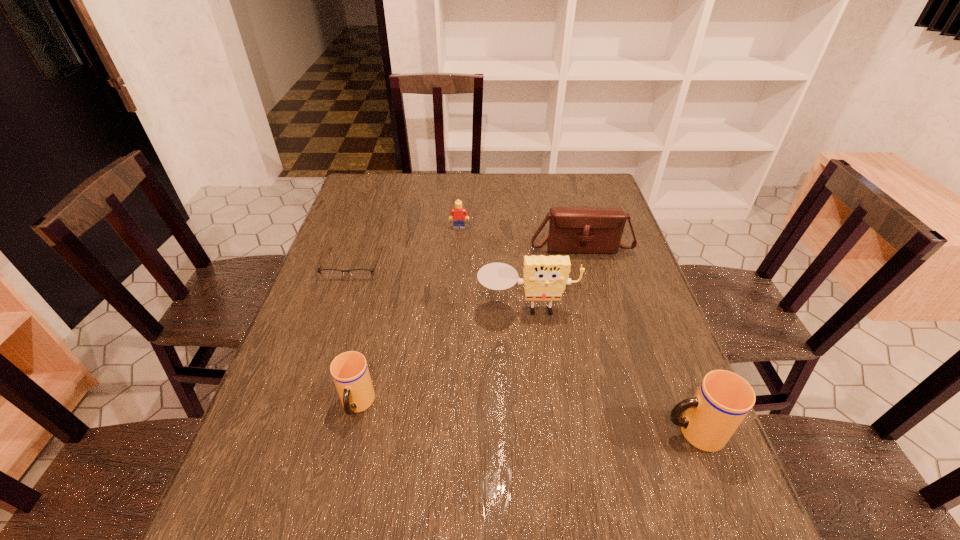
Find the location of a particular element. The image size is (960, 540). the shorter cup is located at coordinates (349, 370).

What are the coordinates of `the right cup` in the screenshot? It's located at (723, 399).

Where is `the farthest object`? the farthest object is located at coordinates (458, 214).

I want to click on the second shortest object, so click(458, 214).

The height and width of the screenshot is (540, 960). What are the coordinates of `shoulder bag` in the screenshot? It's located at pyautogui.click(x=572, y=230).

The width and height of the screenshot is (960, 540). Identify the location of spectacles. tap(326, 273).

The height and width of the screenshot is (540, 960). I want to click on the third nearest object, so click(x=545, y=277).

Locate an element on the screen. Image resolution: width=960 pixels, height=540 pixels. free space located on the side of the taller cup with the handle is located at coordinates (588, 432).

The width and height of the screenshot is (960, 540). I want to click on free space located on the side of the taller cup with the handle, so click(x=612, y=432).

Locate an element on the screen. This screenshot has height=540, width=960. free space located on the side of the taller cup with the handle is located at coordinates (549, 432).